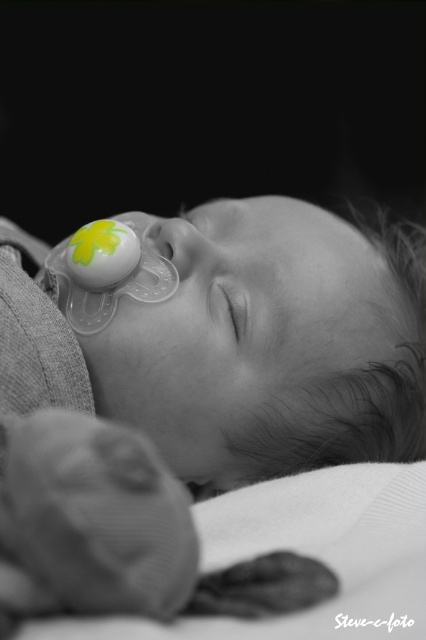
You are a photographer adjusting the lighting in the studio. You notice two pacifiers in the image. Which pacifier, the transparent pacifier at center or the transparent plastic pacifier at upper left, is closer to the camera?

The transparent pacifier at center is closer to the camera than the transparent plastic pacifier at upper left because it is in front of it.

You are a photographer analyzing this black and white photo of a sleeping baby. You notice a point at coordinates (199, 392). What object is located at that point?

The point at coordinates (199, 392) indicates the transparent pacifier at center.

You are a pediatrician examining the image of the sleeping baby. You notice two pacifiers in the scene. Which pacifier, the transparent pacifier at center or the transparent plastic pacifier at upper left, is bigger in size?

The transparent pacifier at center is larger in size compared to the transparent plastic pacifier at upper left.